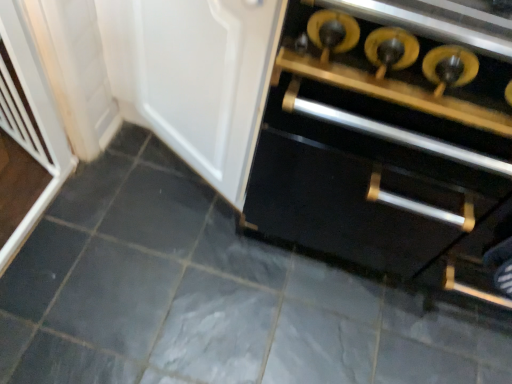
Question: From a real-world perspective, is white plastic screen door at left on top of black matte cabinet at center?

Choices:
 (A) yes
 (B) no

Answer: (B)

Question: Considering the relative sizes of white plastic screen door at left and black matte cabinet at center in the image provided, is white plastic screen door at left thinner than black matte cabinet at center?

Choices:
 (A) no
 (B) yes

Answer: (B)

Question: From the image's perspective, is white plastic screen door at left located beneath black matte cabinet at center?

Choices:
 (A) no
 (B) yes

Answer: (A)

Question: Would you say white plastic screen door at left is outside black matte cabinet at center?

Choices:
 (A) yes
 (B) no

Answer: (A)

Question: Is the surface of white plastic screen door at left in direct contact with black matte cabinet at center?

Choices:
 (A) no
 (B) yes

Answer: (A)

Question: Considering the relative sizes of white plastic screen door at left and black matte cabinet at center in the image provided, is white plastic screen door at left wider than black matte cabinet at center?

Choices:
 (A) yes
 (B) no

Answer: (B)

Question: From a real-world perspective, is black matte cabinet at center over matte white door at center?

Choices:
 (A) no
 (B) yes

Answer: (A)

Question: Would you say black matte cabinet at center is outside matte white door at center?

Choices:
 (A) yes
 (B) no

Answer: (A)

Question: From a real-world perspective, is black matte cabinet at center positioned under matte white door at center based on gravity?

Choices:
 (A) yes
 (B) no

Answer: (A)

Question: Is the position of black matte cabinet at center more distant than that of matte white door at center?

Choices:
 (A) no
 (B) yes

Answer: (A)

Question: Can you confirm if black matte cabinet at center is wider than matte white door at center?

Choices:
 (A) no
 (B) yes

Answer: (B)

Question: Does black matte cabinet at center lie in front of matte white door at center?

Choices:
 (A) no
 (B) yes

Answer: (B)

Question: Is gray matte tile at center positioned with its back to matte white door at center?

Choices:
 (A) yes
 (B) no

Answer: (B)